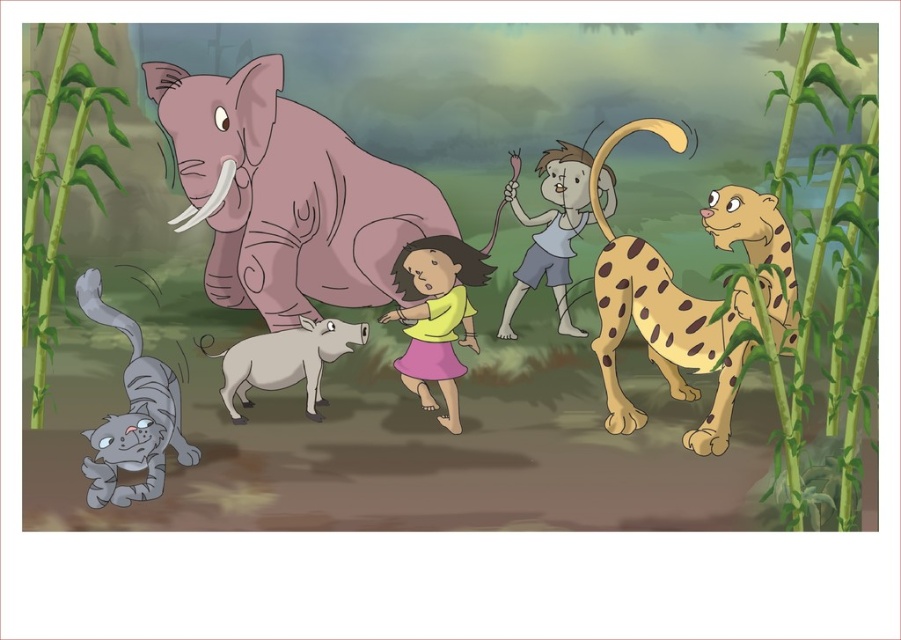
Consider the image. Between pink matte elephant at center and gray furry cat at lower left, which one is positioned lower?

gray furry cat at lower left is below.

Between pink matte elephant at center and gray furry cat at lower left, which one has more height?

Standing taller between the two is pink matte elephant at center.

The image size is (901, 640). What do you see at coordinates (287, 195) in the screenshot?
I see `pink matte elephant at center` at bounding box center [287, 195].

The width and height of the screenshot is (901, 640). What are the coordinates of `pink matte elephant at center` in the screenshot? It's located at (287, 195).

Between point (102, 445) and point (411, 344), which one is positioned in front?

Point (102, 445) is more forward.

Is point (105, 432) closer to camera compared to point (463, 266)?

Yes, it is in front of point (463, 266).

In order to click on gray furry cat at lower left in this screenshot , I will do `click(132, 413)`.

Is pink matte elephant at center smaller than white cotton shirt at center?

Actually, pink matte elephant at center might be larger than white cotton shirt at center.

Is pink matte elephant at center wider than white cotton shirt at center?

Correct, the width of pink matte elephant at center exceeds that of white cotton shirt at center.

Does point (171, 148) come farther from viewer compared to point (531, 256)?

No, (171, 148) is closer to viewer.

The height and width of the screenshot is (640, 901). Find the location of `pink matte elephant at center`. pink matte elephant at center is located at coordinates (287, 195).